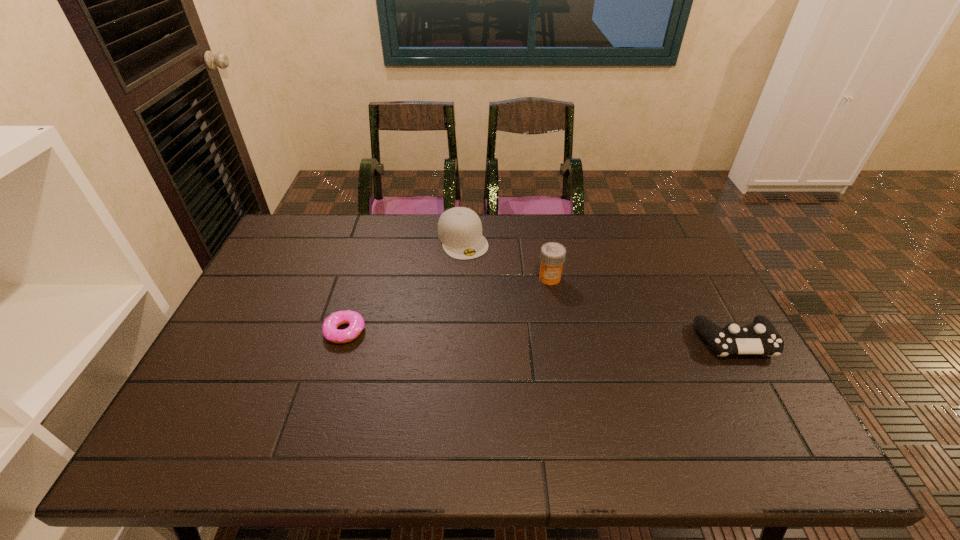
Identify the location of the shortest object. (356, 323).

You are a GUI agent. You are given a task and a screenshot of the screen. Output one action in this format:
    pyautogui.click(x=<x>, y=<y>)
    Task: Click on the doughnut
    Image resolution: width=960 pixels, height=540 pixels.
    Given the screenshot: What is the action you would take?
    pyautogui.click(x=356, y=323)

Where is `control`? The image size is (960, 540). control is located at coordinates (761, 337).

You are a GUI agent. You are given a task and a screenshot of the screen. Output one action in this format:
    pyautogui.click(x=<x>, y=<y>)
    Task: Click on the second shortest object
    Image resolution: width=960 pixels, height=540 pixels.
    Given the screenshot: What is the action you would take?
    pyautogui.click(x=761, y=337)

In order to click on the third nearest object in this screenshot , I will do `click(552, 256)`.

You are a GUI agent. You are given a task and a screenshot of the screen. Output one action in this format:
    pyautogui.click(x=<x>, y=<y>)
    Task: Click on the second object from right to left
    The height and width of the screenshot is (540, 960).
    Given the screenshot: What is the action you would take?
    pyautogui.click(x=552, y=256)

Locate an element on the screen. Image resolution: width=960 pixels, height=540 pixels. cap is located at coordinates (459, 229).

Locate an element on the screen. The height and width of the screenshot is (540, 960). the farthest object is located at coordinates (459, 229).

Where is `blank area located on the back of the doughnut`? This screenshot has height=540, width=960. blank area located on the back of the doughnut is located at coordinates (366, 260).

The height and width of the screenshot is (540, 960). In order to click on vacant space located 0.120m on the surface of the control in this screenshot , I will do `click(770, 403)`.